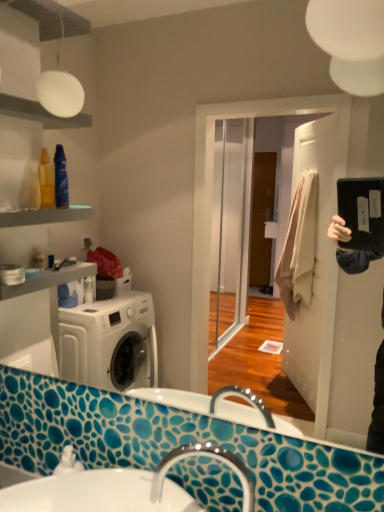
Question: From a real-world perspective, is silver metallic faucet at lower center on top of matte black mirror at upper right?

Choices:
 (A) yes
 (B) no

Answer: (B)

Question: Can you confirm if silver metallic faucet at lower center is positioned to the right of matte black mirror at upper right?

Choices:
 (A) yes
 (B) no

Answer: (A)

Question: Is the depth of silver metallic faucet at lower center greater than that of matte black mirror at upper right?

Choices:
 (A) no
 (B) yes

Answer: (B)

Question: Is silver metallic faucet at lower center shorter than matte black mirror at upper right?

Choices:
 (A) yes
 (B) no

Answer: (A)

Question: Does silver metallic faucet at lower center have a greater height compared to matte black mirror at upper right?

Choices:
 (A) no
 (B) yes

Answer: (A)

Question: Looking at their shapes, would you say silver metallic faucet at lower center is wider or thinner than matte black mirror at upper right?

Choices:
 (A) thin
 (B) wide

Answer: (B)

Question: Would you say silver metallic faucet at lower center is inside or outside matte black mirror at upper right?

Choices:
 (A) inside
 (B) outside

Answer: (B)

Question: Based on their positions, is silver metallic faucet at lower center located to the left or right of matte black mirror at upper right?

Choices:
 (A) left
 (B) right

Answer: (B)

Question: Does point (248, 506) appear closer or farther from the camera than point (314, 350)?

Choices:
 (A) closer
 (B) farther

Answer: (A)

Question: From the image's perspective, is silver metallic faucet at lower center located above or below white glossy sink at lower center?

Choices:
 (A) below
 (B) above

Answer: (B)

Question: Is silver metallic faucet at lower center taller or shorter than white glossy sink at lower center?

Choices:
 (A) tall
 (B) short

Answer: (A)

Question: Would you say silver metallic faucet at lower center is inside or outside white glossy sink at lower center?

Choices:
 (A) inside
 (B) outside

Answer: (B)

Question: In the image, is silver metallic faucet at lower center positioned in front of or behind white glossy sink at lower center?

Choices:
 (A) front
 (B) behind

Answer: (B)

Question: Visually, is matte black mirror at upper right positioned to the left or to the right of white glossy sink at lower center?

Choices:
 (A) left
 (B) right

Answer: (B)

Question: In terms of width, does matte black mirror at upper right look wider or thinner when compared to white glossy sink at lower center?

Choices:
 (A) thin
 (B) wide

Answer: (A)